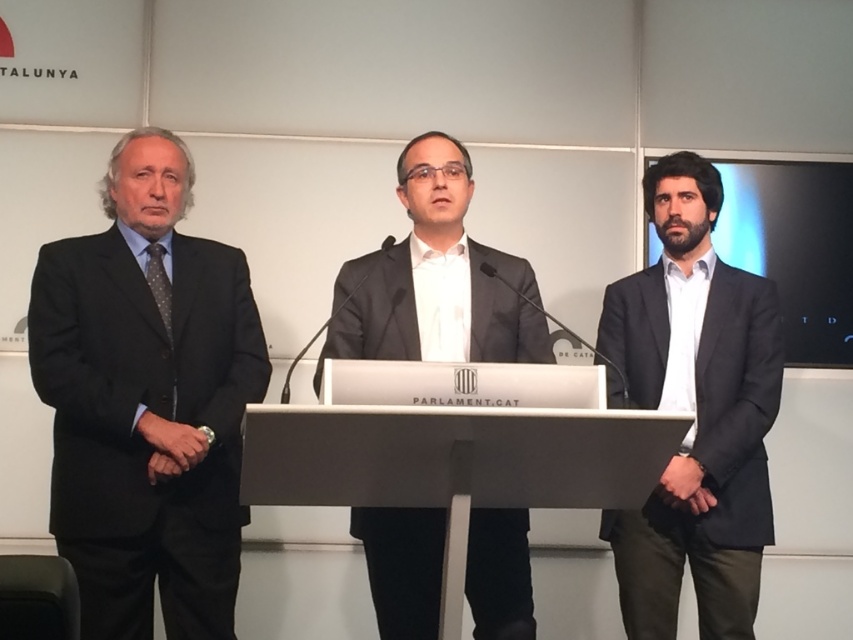
You are organizing a formal event and need to arrange seating for two officials wearing the matte black suit at left and dark gray suit at right. The seating area has a narrow bench that can only accommodate one person at a time. Based on their suits, which official should sit first to ensure both can fit comfortably?

The dark gray suit at right should sit first because the matte black suit at left is wider, so placing the narrower dark gray suit at right first allows more space for the wider matte black suit at left to fit comfortably afterward.

You are standing in front of the podium and want to place a small plant between the two points marked as point [126,198] and point [407,468]. Can you determine which point is closer to you to ensure the plant is placed correctly?

Point [126,198] is closer to you than point [407,468], so place the plant near that point to ensure it is positioned correctly between them.